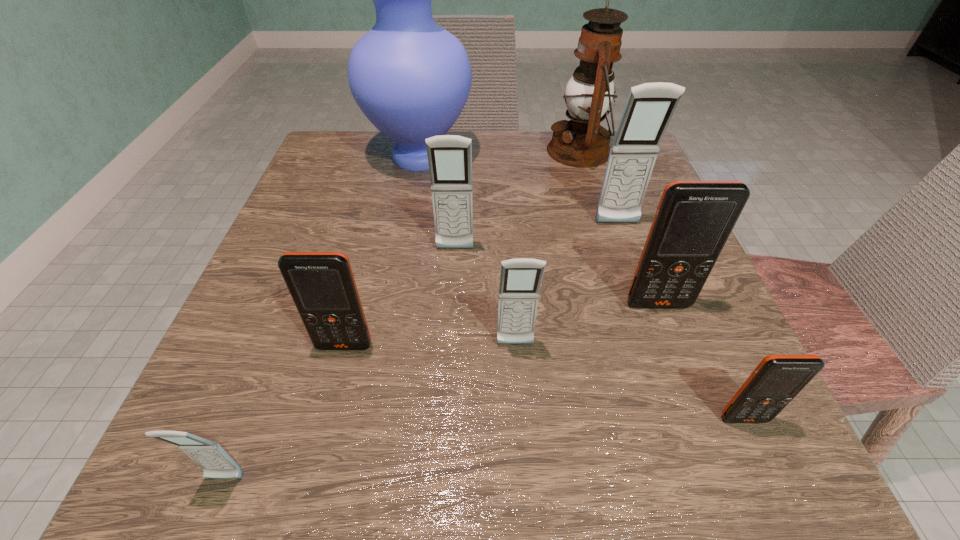
Choose which object is the second nearest neighbor to the fifth farthest object. Please provide its 2D coordinates. Your answer should be formatted as a tuple, i.e. [(x, y)], where the tuple contains the x and y coordinates of a point satisfying the conditions above.

[(650, 107)]

Locate an element on the screen. cellular telephone that is the third closest to the third gray cellular telephone from left to right is located at coordinates (449, 156).

Identify the location of the third closest cellular telephone to the fourth cellular telephone from left to right. The image size is (960, 540). (449, 156).

Point out which gray cellular telephone is positioned as the second nearest to the leftmost orange cellular telephone. Please provide its 2D coordinates. Your answer should be formatted as a tuple, i.e. [(x, y)], where the tuple contains the x and y coordinates of a point satisfying the conditions above.

[(520, 279)]

Where is `gray cellular telephone that is the second nearest to the smallest orange cellular telephone`? The image size is (960, 540). gray cellular telephone that is the second nearest to the smallest orange cellular telephone is located at coordinates (650, 107).

Find the location of a particular element. The height and width of the screenshot is (540, 960). orange cellular telephone that is the third closest to the leftmost gray cellular telephone is located at coordinates (777, 379).

This screenshot has height=540, width=960. In order to click on orange cellular telephone that is the second nearest to the vase in this screenshot , I will do `click(694, 219)`.

Image resolution: width=960 pixels, height=540 pixels. I want to click on vacant space that satisfies the following two spatial constraints: 1. on the side of the lantern, there is a wick adjustment knob; 2. on the screen of the leftmost orange cellular telephone, so click(x=637, y=346).